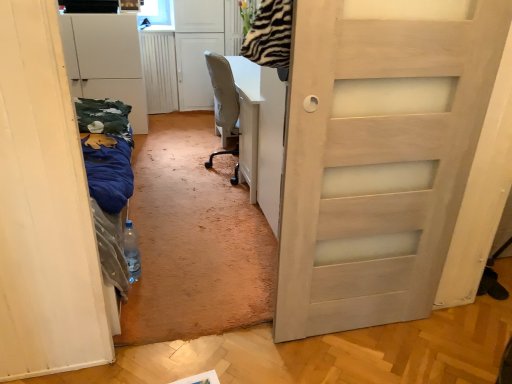
Question: Should I look upward or downward to see white matte cabinet at left?

Choices:
 (A) up
 (B) down

Answer: (A)

Question: Is white matte door at left surrounding translucent plastic bottle at center?

Choices:
 (A) yes
 (B) no

Answer: (A)

Question: Does white matte door at left have a smaller size compared to translucent plastic bottle at center?

Choices:
 (A) no
 (B) yes

Answer: (A)

Question: From a real-world perspective, is white matte door at left located higher than translucent plastic bottle at center?

Choices:
 (A) no
 (B) yes

Answer: (B)

Question: From the image's perspective, is white matte door at left on translucent plastic bottle at center?

Choices:
 (A) yes
 (B) no

Answer: (A)

Question: Is white matte door at left outside of translucent plastic bottle at center?

Choices:
 (A) yes
 (B) no

Answer: (A)

Question: Can you confirm if white matte door at left is bigger than translucent plastic bottle at center?

Choices:
 (A) no
 (B) yes

Answer: (B)

Question: Considering the relative positions of white matte cabinet at left and white matte door at left in the image provided, is white matte cabinet at left to the right of white matte door at left from the viewer's perspective?

Choices:
 (A) yes
 (B) no

Answer: (B)

Question: Can you confirm if white matte cabinet at left is bigger than white matte door at left?

Choices:
 (A) yes
 (B) no

Answer: (B)

Question: Is the depth of white matte cabinet at left less than that of white matte door at left?

Choices:
 (A) yes
 (B) no

Answer: (B)

Question: Does white matte cabinet at left turn towards white matte door at left?

Choices:
 (A) yes
 (B) no

Answer: (A)

Question: From the image's perspective, does white matte cabinet at left appear lower than white matte door at left?

Choices:
 (A) no
 (B) yes

Answer: (A)

Question: Is white matte cabinet at left outside of white matte door at left?

Choices:
 (A) yes
 (B) no

Answer: (A)

Question: From the image's perspective, would you say translucent plastic bottle at center is shown under white matte door at left?

Choices:
 (A) yes
 (B) no

Answer: (A)